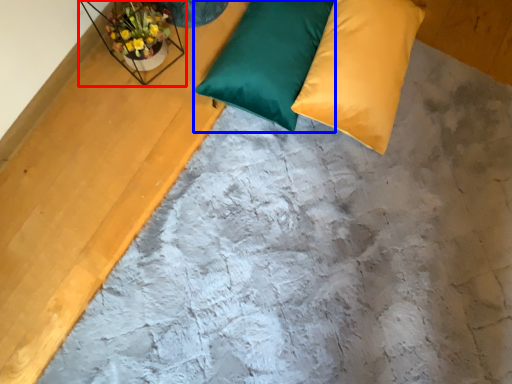
Question: Which object is closer to the camera taking this photo, window sill (highlighted by a red box) or pillow (highlighted by a blue box)?

Choices:
 (A) window sill
 (B) pillow

Answer: (A)